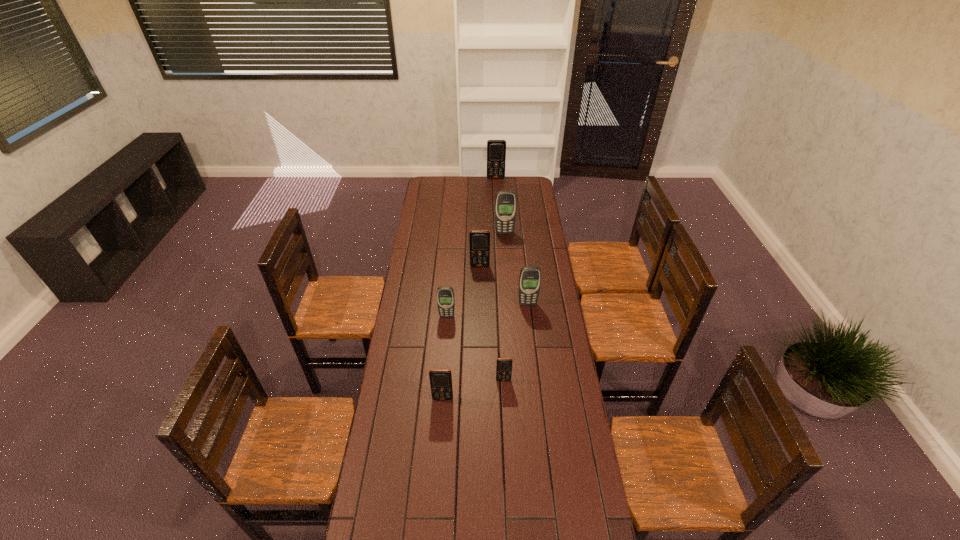
This screenshot has height=540, width=960. Find the location of `the farthest object`. the farthest object is located at coordinates (496, 149).

Where is `the farthest orange cellular telephone`? the farthest orange cellular telephone is located at coordinates (496, 149).

At what (x,y) coordinates should I click in order to perform the action: click on the second farthest cellular telephone. Please return your answer as a coordinate pair (x, y). Looking at the image, I should click on (505, 203).

Identify the location of the biggest gray cellular telephone. (505, 203).

Where is `the second biggest orange cellular telephone`? the second biggest orange cellular telephone is located at coordinates (479, 239).

I want to click on the third nearest orange cellular telephone, so [x=479, y=239].

Locate an element on the screen. the second farthest gray cellular telephone is located at coordinates (530, 276).

At what (x,y) coordinates should I click in order to perform the action: click on the fourth nearest object. Please return your answer as a coordinate pair (x, y). This screenshot has width=960, height=540. Looking at the image, I should click on (530, 276).

The image size is (960, 540). In order to click on the fifth farthest object in this screenshot , I will do point(445,295).

Identify the location of the nearest gray cellular telephone. The image size is (960, 540). click(445, 295).